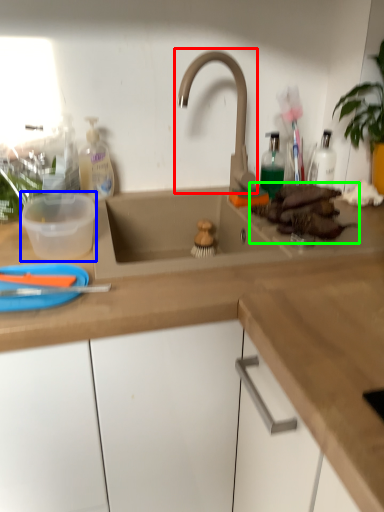
Question: Estimate the real-world distances between objects in this image. Which object is farther from tap (highlighted by a red box), basin (highlighted by a blue box) or food (highlighted by a green box)?

Choices:
 (A) basin
 (B) food

Answer: (A)